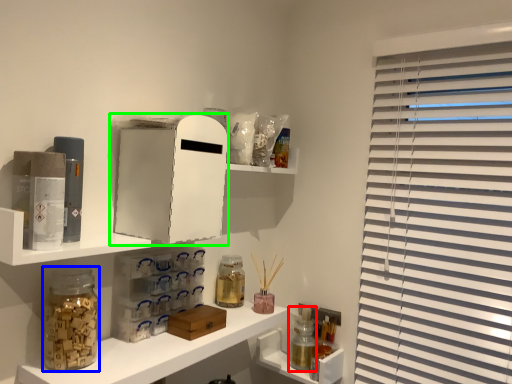
Question: Which is farther away from bottle (highlighted by a red box)? glass jar (highlighted by a blue box) or medicine cabinet (highlighted by a green box)?

Choices:
 (A) glass jar
 (B) medicine cabinet

Answer: (A)